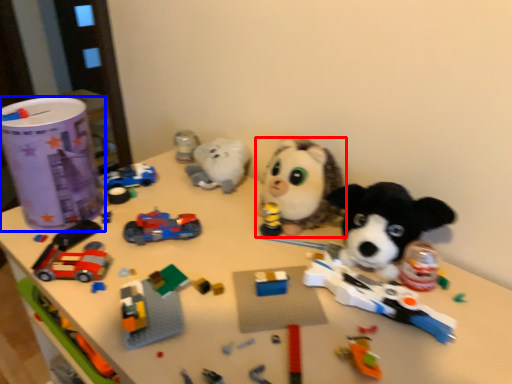
Question: Which object is closer to the camera taking this photo, toy (highlighted by a red box) or toy (highlighted by a blue box)?

Choices:
 (A) toy
 (B) toy

Answer: (A)